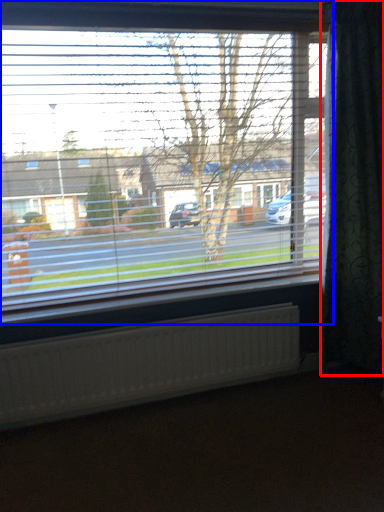
Question: Among these objects, which one is nearest to the camera, curtain (highlighted by a red box) or window (highlighted by a blue box)?

Choices:
 (A) curtain
 (B) window

Answer: (B)